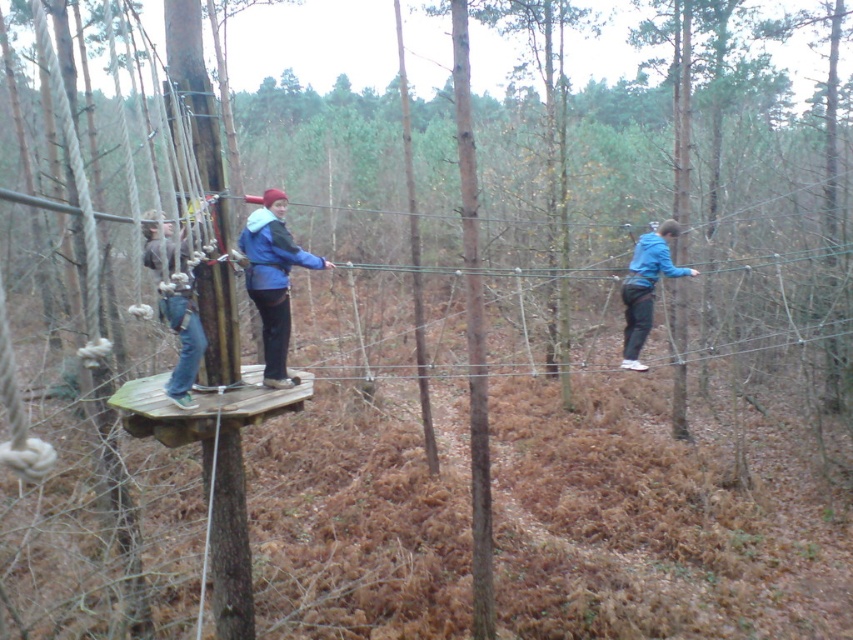
Does point (267, 342) come in front of point (643, 323)?

Yes, it is.

At what (x,y) coordinates should I click in order to perform the action: click on blue fleece jacket at center. Please return your answer as a coordinate pair (x, y). Looking at the image, I should click on (271, 280).

Does blue fabric jacket at center appear on the right side of blue matte jacket at right?

Incorrect, blue fabric jacket at center is not on the right side of blue matte jacket at right.

Image resolution: width=853 pixels, height=640 pixels. What do you see at coordinates (177, 308) in the screenshot? I see `blue fabric jacket at center` at bounding box center [177, 308].

The width and height of the screenshot is (853, 640). I want to click on blue fabric jacket at center, so click(177, 308).

Which is above, blue fleece jacket at center or blue fabric jacket at center?

Positioned higher is blue fleece jacket at center.

Does blue fleece jacket at center have a smaller size compared to blue fabric jacket at center?

No.

Measure the distance between blue fleece jacket at center and camera.

blue fleece jacket at center and camera are 6.16 meters apart.

This screenshot has height=640, width=853. What are the coordinates of `blue fleece jacket at center` in the screenshot? It's located at (271, 280).